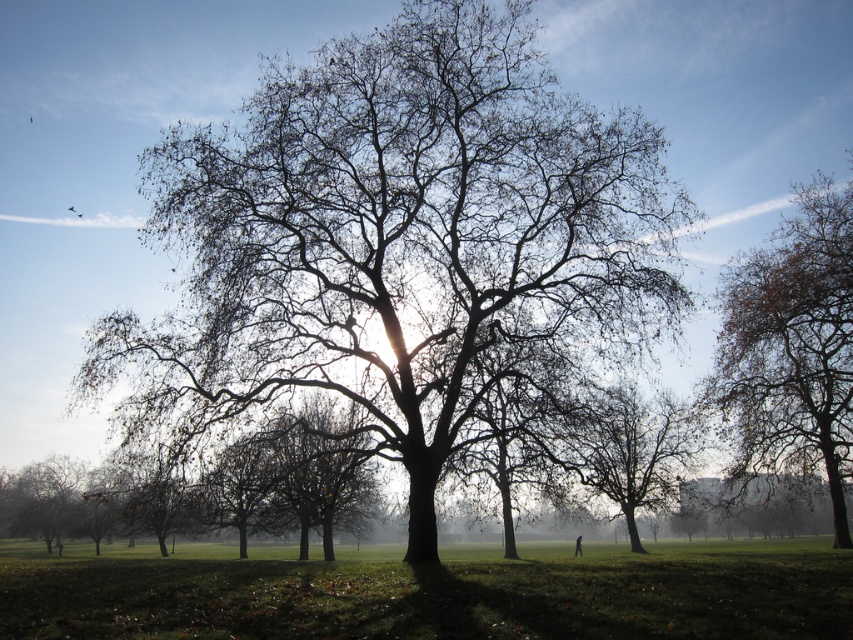
Question: Which of these objects is positioned farthest from the bare branches at center?

Choices:
 (A) smooth brown tree at center
 (B) smooth bark tree at center
 (C) smooth gray tree at lower left
 (D) brown textured tree at right

Answer: (C)

Question: Can you confirm if brown textured tree at right is smaller than brown/dry wood tree at center?

Choices:
 (A) yes
 (B) no

Answer: (A)

Question: Which of the following is the closest to the observer?

Choices:
 (A) (473, 620)
 (B) (641, 496)

Answer: (A)

Question: Is bare branches at center bigger than brown textured tree at right?

Choices:
 (A) no
 (B) yes

Answer: (B)

Question: Is smooth bark tree at center to the left of smooth brown tree at center from the viewer's perspective?

Choices:
 (A) yes
 (B) no

Answer: (B)

Question: Which object appears farthest from the camera in this image?

Choices:
 (A) green grass at center
 (B) brown textured tree at right
 (C) smooth bark tree at center
 (D) smooth brown tree at center

Answer: (B)